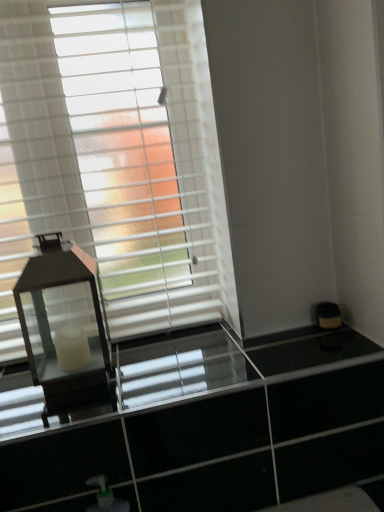
Question: From a real-world perspective, is clear glass dresser at center located higher than matte black lantern at left?

Choices:
 (A) no
 (B) yes

Answer: (A)

Question: Is the depth of clear glass dresser at center greater than that of matte black lantern at left?

Choices:
 (A) yes
 (B) no

Answer: (B)

Question: Can you confirm if clear glass dresser at center is wider than matte black lantern at left?

Choices:
 (A) no
 (B) yes

Answer: (B)

Question: Is matte black lantern at left located within clear glass dresser at center?

Choices:
 (A) no
 (B) yes

Answer: (A)

Question: Considering the relative sizes of clear glass dresser at center and matte black lantern at left in the image provided, is clear glass dresser at center shorter than matte black lantern at left?

Choices:
 (A) no
 (B) yes

Answer: (B)

Question: Is clear glass dresser at center facing away from matte black lantern at left?

Choices:
 (A) yes
 (B) no

Answer: (B)

Question: Can you confirm if white matte window blind at upper left is taller than matte black lantern at left?

Choices:
 (A) yes
 (B) no

Answer: (A)

Question: Would you consider white matte window blind at upper left to be distant from matte black lantern at left?

Choices:
 (A) yes
 (B) no

Answer: (B)

Question: Is matte black lantern at left completely or partially inside white matte window blind at upper left?

Choices:
 (A) no
 (B) yes

Answer: (A)

Question: Does white matte window blind at upper left have a larger size compared to matte black lantern at left?

Choices:
 (A) yes
 (B) no

Answer: (A)

Question: From the image's perspective, is white matte window blind at upper left under matte black lantern at left?

Choices:
 (A) no
 (B) yes

Answer: (A)

Question: Considering the relative sizes of white matte window blind at upper left and matte black lantern at left in the image provided, is white matte window blind at upper left shorter than matte black lantern at left?

Choices:
 (A) no
 (B) yes

Answer: (A)

Question: Does matte black lantern at left appear on the right side of white matte window blind at upper left?

Choices:
 (A) yes
 (B) no

Answer: (B)